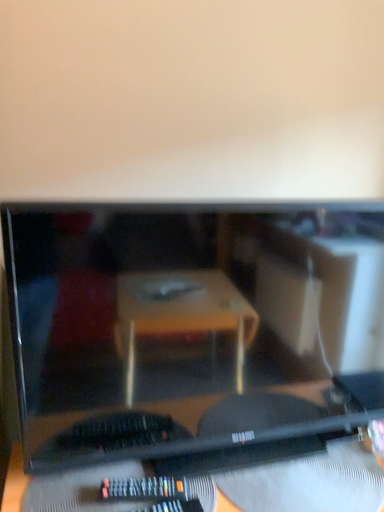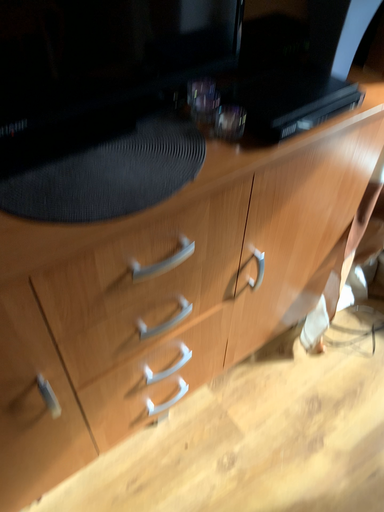
Question: Which way did the camera rotate in the video?

Choices:
 (A) rotated right
 (B) rotated left

Answer: (A)